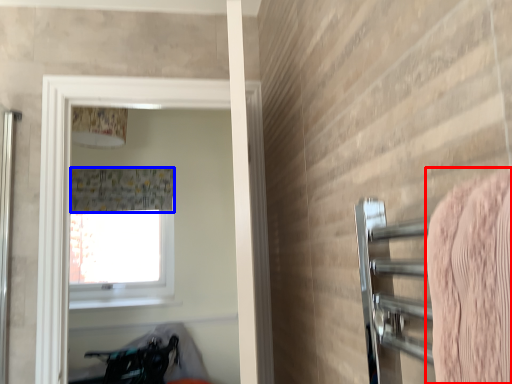
Question: Among these objects, which one is farthest to the camera, bath towel (highlighted by a red box) or shower curtain (highlighted by a blue box)?

Choices:
 (A) bath towel
 (B) shower curtain

Answer: (B)